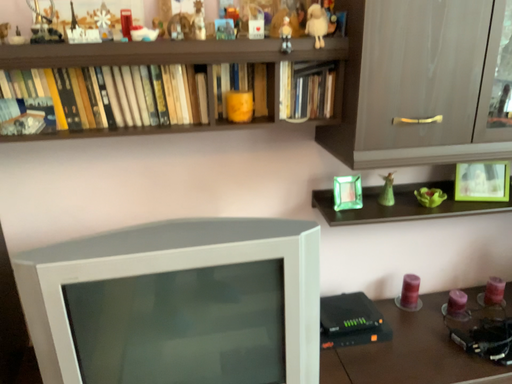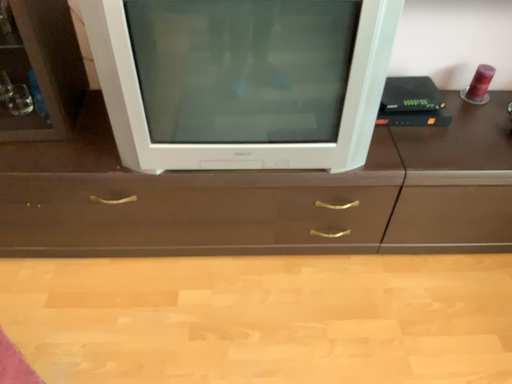
Question: How did the camera likely rotate when shooting the video?

Choices:
 (A) rotated upward
 (B) rotated downward

Answer: (B)